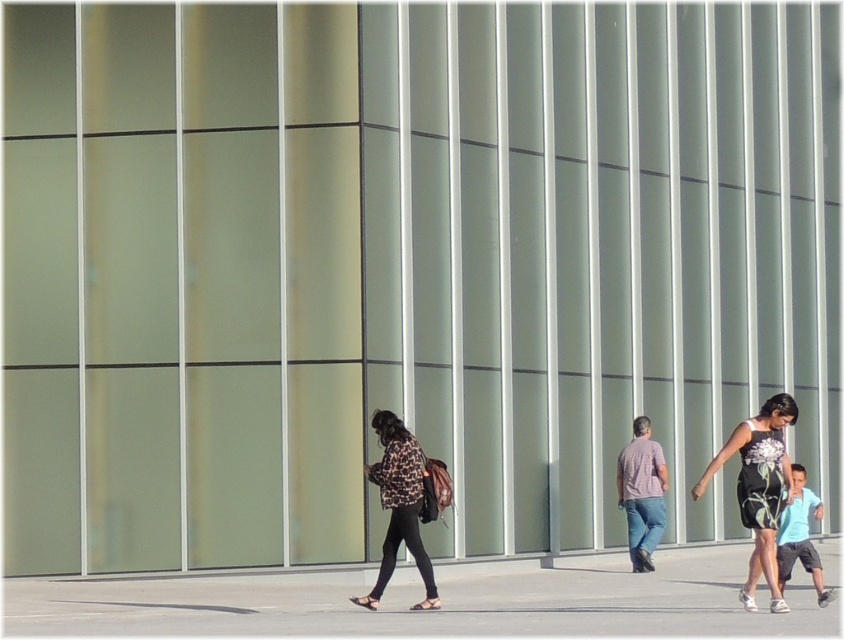
You are standing in front of the large glass facade and see the leopard print jacket at center. If you want to take a photo of it without any reflections from the glass, where should you position yourself relative to the jacket?

The leopard print jacket at center is located at point (399,506). To avoid reflections from the glass facade, position yourself so that the jacket is not directly in line with the reflective surfaces of the glass. Since the glass panels are arranged vertically, ensure you are not directly facing the same vertical plane as the jacket to minimize reflections.

You are a delivery person trying to navigate through the urban scene. You need to place a large package on the gray concrete pavement at center. However, there is a black floral dress at right nearby. Based on their widths, will the package fit on the pavement without overlapping the dress?

The gray concrete pavement at center might be wider than black floral dress at right, so there is a possibility that the package can fit without overlapping, but the exact width difference isn not specified.